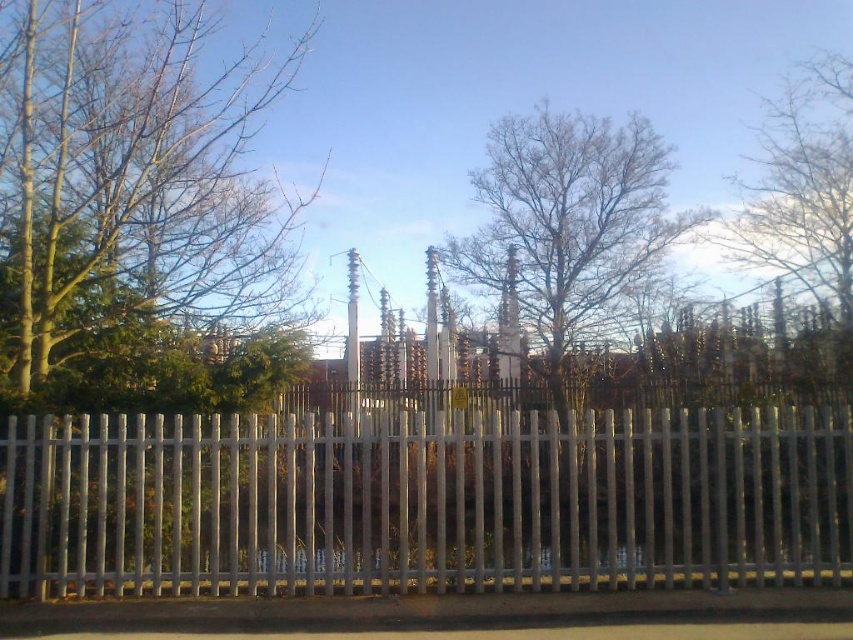
Can you confirm if white metal fence at center is positioned to the left of green leafy tree at left?

Incorrect, white metal fence at center is not on the left side of green leafy tree at left.

Is point (299, 417) positioned before point (172, 310)?

No.

Where is `white metal fence at center`? The height and width of the screenshot is (640, 853). white metal fence at center is located at coordinates (422, 500).

Is point (28, 390) farther from viewer compared to point (848, 86)?

That is False.

Can you confirm if green leafy tree at left is positioned to the right of bare branches at upper right?

In fact, green leafy tree at left is to the left of bare branches at upper right.

The width and height of the screenshot is (853, 640). What do you see at coordinates (138, 212) in the screenshot?
I see `green leafy tree at left` at bounding box center [138, 212].

Identify the location of green leafy tree at left. (138, 212).

Who is taller, white metal fence at center or bare branches at upper right?

With more height is bare branches at upper right.

Which is below, white metal fence at center or bare branches at upper right?

white metal fence at center is below.

This screenshot has width=853, height=640. Find the location of `white metal fence at center`. white metal fence at center is located at coordinates (422, 500).

The image size is (853, 640). I want to click on white metal fence at center, so click(x=422, y=500).